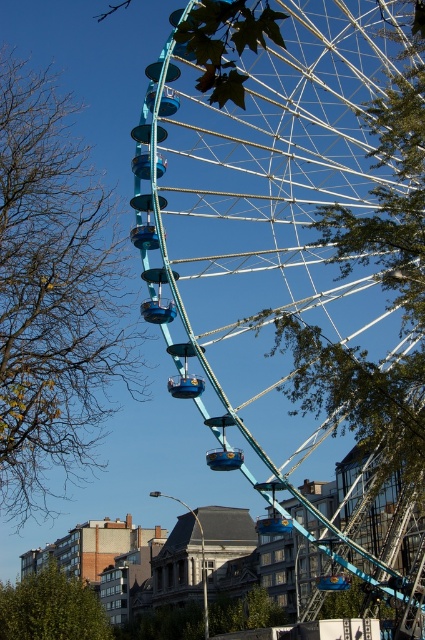
Question: Does green leafy tree at left appear over green leafy tree at lower left?

Choices:
 (A) yes
 (B) no

Answer: (A)

Question: Considering the relative positions of teal metallic ferris wheel at center and green leafy tree at left in the image provided, where is teal metallic ferris wheel at center located with respect to green leafy tree at left?

Choices:
 (A) left
 (B) right

Answer: (B)

Question: Can you confirm if teal metallic ferris wheel at center is positioned below green leafy tree at left?

Choices:
 (A) yes
 (B) no

Answer: (B)

Question: Among these points, which one is nearest to the camera?

Choices:
 (A) (248, 68)
 (B) (0, 193)

Answer: (B)

Question: Which object is positioned closest to the green leafy tree at lower left?

Choices:
 (A) teal metallic ferris wheel at center
 (B) green leafy tree at left

Answer: (B)

Question: Which point is farther from the camera taking this photo?

Choices:
 (A) coord(34,600)
 (B) coord(348,346)
 (C) coord(81,227)

Answer: (A)